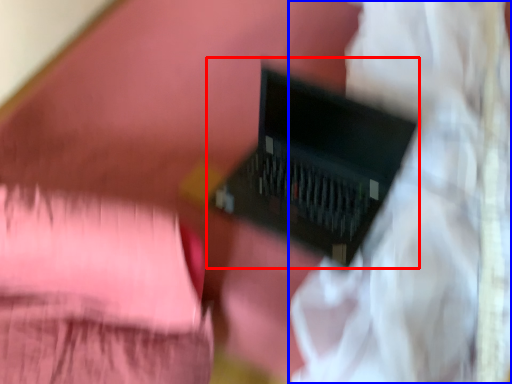
Question: Which object appears farthest to the camera in this image, computer (highlighted by a red box) or curtain (highlighted by a blue box)?

Choices:
 (A) computer
 (B) curtain

Answer: (A)